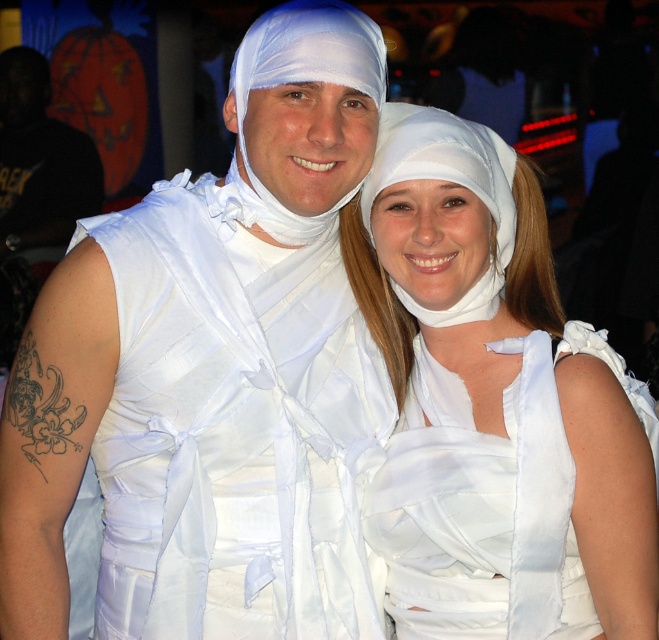
Does white satin dress at center have a lesser height compared to white satin/crepe dress at center?

In fact, white satin dress at center may be taller than white satin/crepe dress at center.

Does white satin dress at center have a greater height compared to white satin/crepe dress at center?

Yes.

Locate an element on the screen. white satin dress at center is located at coordinates (500, 410).

At what (x,y) coordinates should I click in order to perform the action: click on white satin dress at center. Please return your answer as a coordinate pair (x, y). The height and width of the screenshot is (640, 659). Looking at the image, I should click on (500, 410).